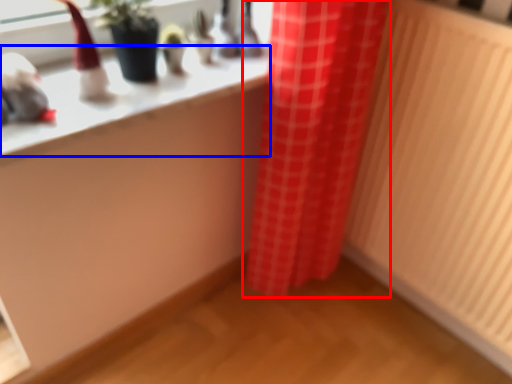
Question: Which object appears farthest to the camera in this image, curtain (highlighted by a red box) or counter top (highlighted by a blue box)?

Choices:
 (A) curtain
 (B) counter top

Answer: (A)